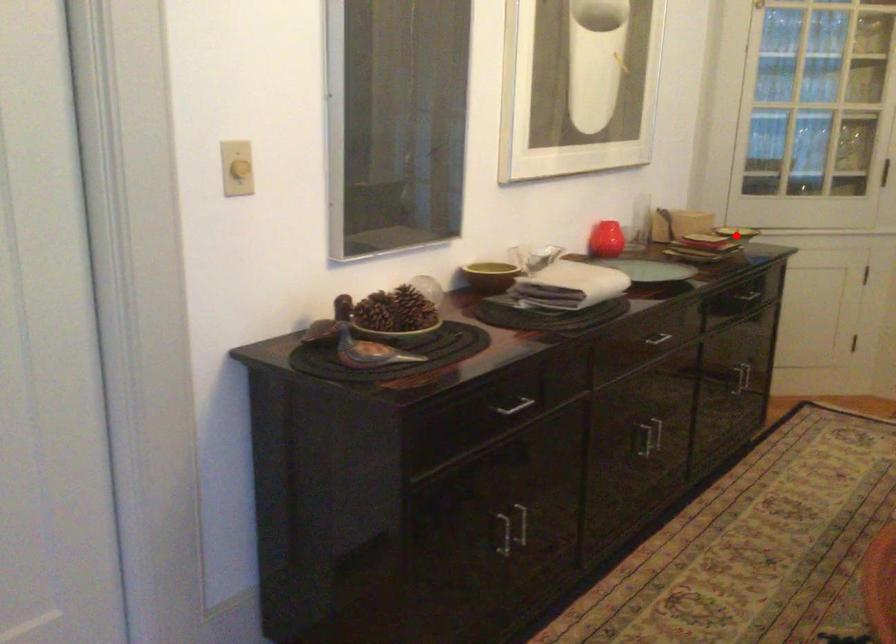
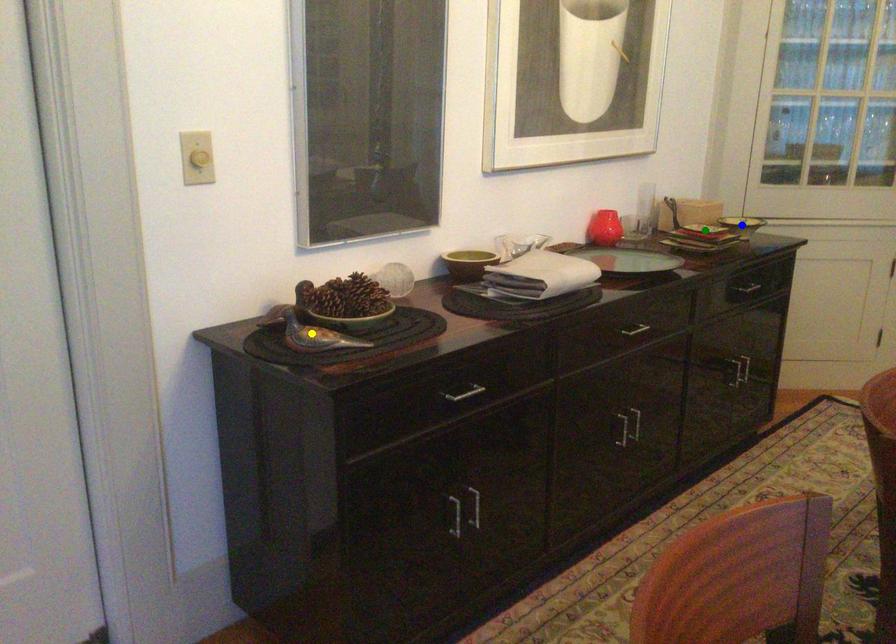
Question: I am providing you with two images of the same scene from different viewpoints. A red point is marked on the first image. You are given multiple points on the second image. Which mark in image 2 goes with the point in image 1?

Choices:
 (A) green point
 (B) blue point
 (C) yellow point

Answer: (B)